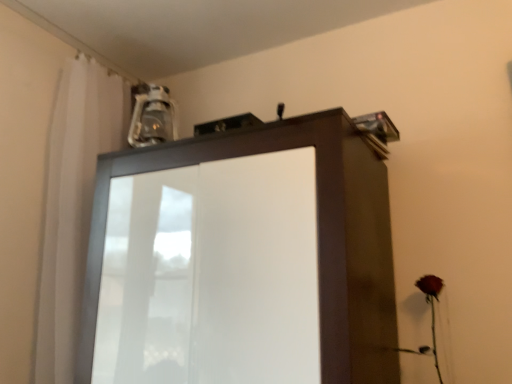
Where is `matte brown cupboard at upper center`? matte brown cupboard at upper center is located at coordinates (243, 260).

I want to click on white sheer curtain at upper left, so click(72, 204).

How different are the orientations of white sheer curtain at upper left and matte red rose at lower right in degrees?

They differ by 91.5 degrees in their facing directions.

Is white sheer curtain at upper left oriented towards matte red rose at lower right?

Yes.

Does white sheer curtain at upper left touch matte red rose at lower right?

They are not placed beside each other.

Does white sheer curtain at upper left have a larger size compared to matte red rose at lower right?

Yes, white sheer curtain at upper left is bigger than matte red rose at lower right.

Is matte brown cupboard at upper center surrounding white sheer curtain at upper left?

No, white sheer curtain at upper left is located outside of matte brown cupboard at upper center.

Which object is wider, matte brown cupboard at upper center or white sheer curtain at upper left?

Wider between the two is matte brown cupboard at upper center.

Between matte brown cupboard at upper center and white sheer curtain at upper left, which one appears on the right side from the viewer's perspective?

matte brown cupboard at upper center is more to the right.

Consider the image. Is matte brown cupboard at upper center oriented towards white sheer curtain at upper left?

No, matte brown cupboard at upper center is not facing towards white sheer curtain at upper left.

Considering the sizes of objects matte red rose at lower right and matte brown cupboard at upper center in the image provided, who is smaller, matte red rose at lower right or matte brown cupboard at upper center?

Smaller between the two is matte red rose at lower right.

The width and height of the screenshot is (512, 384). I want to click on cupboard in front of the matte red rose at lower right, so click(243, 260).

Consider the image. Is the position of matte red rose at lower right more distant than that of matte brown cupboard at upper center?

Yes, it is behind matte brown cupboard at upper center.

Would you say white sheer curtain at upper left contains matte brown cupboard at upper center?

Actually, matte brown cupboard at upper center is outside white sheer curtain at upper left.

From the picture: Which object is more forward, white sheer curtain at upper left or matte brown cupboard at upper center?

matte brown cupboard at upper center is in front.

The height and width of the screenshot is (384, 512). I want to click on shower curtain positioned vertically above the matte brown cupboard at upper center (from a real-world perspective), so click(x=72, y=204).

Is white sheer curtain at upper left to the left of matte brown cupboard at upper center from the viewer's perspective?

Yes.

Who is shorter, matte red rose at lower right or white sheer curtain at upper left?

matte red rose at lower right is shorter.

Is white sheer curtain at upper left surrounded by matte red rose at lower right?

No, matte red rose at lower right does not contain white sheer curtain at upper left.

From a real-world perspective, which object rests below the other?

In real-world perspective, matte red rose at lower right is lower.

From a real-world perspective, between matte brown cupboard at upper center and matte red rose at lower right, who is vertically lower?

matte red rose at lower right is physically lower.

Which of these two, matte brown cupboard at upper center or matte red rose at lower right, is smaller?

matte red rose at lower right is smaller.

Would you consider matte brown cupboard at upper center to be distant from matte red rose at lower right?

No, there isn't a large distance between matte brown cupboard at upper center and matte red rose at lower right.

Where is `flower below the white sheer curtain at upper left (from the image's perspective)`? The width and height of the screenshot is (512, 384). flower below the white sheer curtain at upper left (from the image's perspective) is located at coordinates (432, 308).

Where is `shower curtain behind the matte brown cupboard at upper center`? The image size is (512, 384). shower curtain behind the matte brown cupboard at upper center is located at coordinates (72, 204).

Considering their positions, is matte brown cupboard at upper center positioned closer to white sheer curtain at upper left than matte red rose at lower right?

matte brown cupboard at upper center lies closer to white sheer curtain at upper left than the other object.

When comparing their distances from matte brown cupboard at upper center, does matte red rose at lower right or white sheer curtain at upper left seem further?

The object further to matte brown cupboard at upper center is matte red rose at lower right.

When comparing their distances from matte brown cupboard at upper center, does white sheer curtain at upper left or matte red rose at lower right seem closer?

Among the two, white sheer curtain at upper left is located nearer to matte brown cupboard at upper center.

Which object lies further to the anchor point matte red rose at lower right, matte brown cupboard at upper center or white sheer curtain at upper left?

white sheer curtain at upper left.

Estimate the real-world distances between objects in this image. Which object is further from white sheer curtain at upper left, matte red rose at lower right or matte brown cupboard at upper center?

matte red rose at lower right.

When comparing their distances from matte red rose at lower right, does white sheer curtain at upper left or matte brown cupboard at upper center seem closer?

matte brown cupboard at upper center lies closer to matte red rose at lower right than the other object.

The image size is (512, 384). I want to click on cupboard between white sheer curtain at upper left and matte red rose at lower right, so click(x=243, y=260).